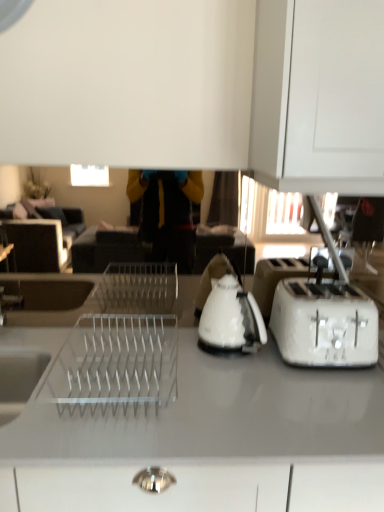
Question: Can you confirm if white plastic toaster at right is bigger than white glossy countertop at center?

Choices:
 (A) no
 (B) yes

Answer: (A)

Question: Would you say white plastic toaster at right is a long distance from white glossy countertop at center?

Choices:
 (A) no
 (B) yes

Answer: (A)

Question: Considering the relative positions of white plastic toaster at right and white glossy countertop at center in the image provided, is white plastic toaster at right to the left of white glossy countertop at center from the viewer's perspective?

Choices:
 (A) no
 (B) yes

Answer: (A)

Question: Does white plastic toaster at right turn towards white glossy countertop at center?

Choices:
 (A) no
 (B) yes

Answer: (A)

Question: From the image's perspective, would you say white plastic toaster at right is positioned over white glossy countertop at center?

Choices:
 (A) yes
 (B) no

Answer: (A)

Question: From the image's perspective, is white plastic toaster at right below white glossy countertop at center?

Choices:
 (A) yes
 (B) no

Answer: (B)

Question: Is white glossy countertop at center taller than white glossy kettle at center?

Choices:
 (A) no
 (B) yes

Answer: (B)

Question: Is white glossy countertop at center to the left of white glossy kettle at center from the viewer's perspective?

Choices:
 (A) no
 (B) yes

Answer: (B)

Question: Is white glossy countertop at center positioned behind white glossy kettle at center?

Choices:
 (A) no
 (B) yes

Answer: (A)

Question: Can you confirm if white glossy countertop at center is positioned to the right of white glossy kettle at center?

Choices:
 (A) yes
 (B) no

Answer: (B)

Question: Is white glossy countertop at center positioned with its back to white glossy kettle at center?

Choices:
 (A) no
 (B) yes

Answer: (A)

Question: Considering the relative sizes of white glossy countertop at center and white glossy kettle at center in the image provided, is white glossy countertop at center smaller than white glossy kettle at center?

Choices:
 (A) no
 (B) yes

Answer: (A)

Question: Considering the relative sizes of white plastic toaster at right and white glossy kettle at center in the image provided, is white plastic toaster at right taller than white glossy kettle at center?

Choices:
 (A) yes
 (B) no

Answer: (B)